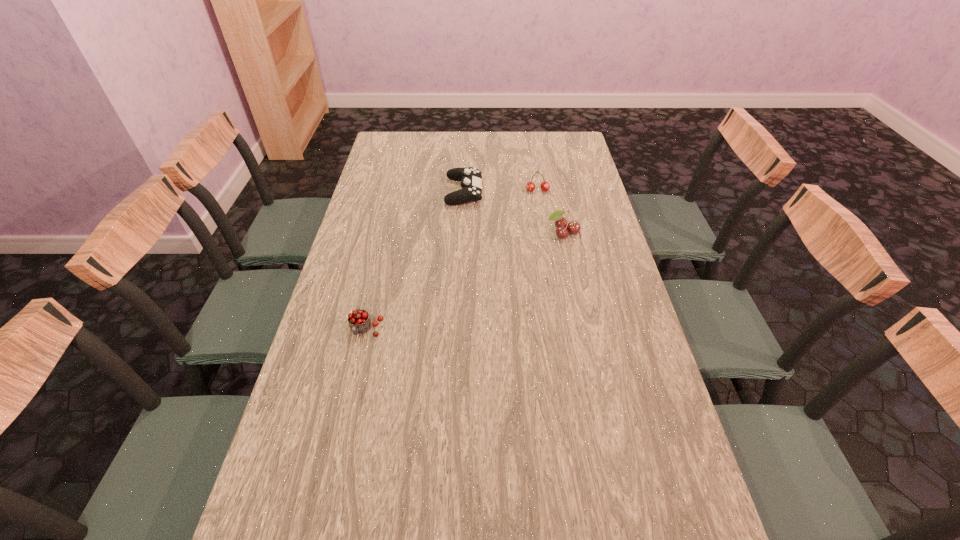
This screenshot has width=960, height=540. I want to click on the third farthest object, so click(573, 227).

I want to click on the farthest cherry, so click(530, 186).

At what (x,y) coordinates should I click in order to perform the action: click on the leftmost cherry. Please return your answer as a coordinate pair (x, y). The height and width of the screenshot is (540, 960). Looking at the image, I should click on (359, 321).

This screenshot has height=540, width=960. What are the coordinates of `the nearest cherry` in the screenshot? It's located at (359, 321).

Where is `control`? This screenshot has width=960, height=540. control is located at coordinates (471, 178).

This screenshot has width=960, height=540. I want to click on free space located on the leaves of the third farthest object, so click(x=576, y=295).

You are a GUI agent. You are given a task and a screenshot of the screen. Output one action in this format:
    pyautogui.click(x=<x>, y=<y>)
    Task: Click on the vacant region located 0.080m with stems pointing upwards on the farthest cherry
    This screenshot has height=540, width=960.
    Given the screenshot: What is the action you would take?
    pyautogui.click(x=540, y=207)

At what (x,y) coordinates should I click in order to perform the action: click on vacant space situated on the handle side of the leftmost object. Please return your answer as a coordinate pair (x, y). Looking at the image, I should click on (344, 424).

What are the coordinates of `vacant space located on the surface of the control` in the screenshot? It's located at (498, 192).

Identify the location of object that is positioned at the left edge. (359, 321).